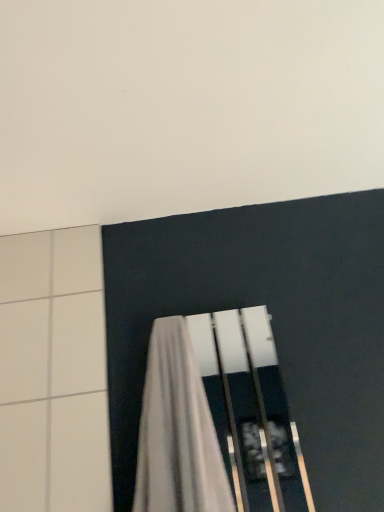
This screenshot has height=512, width=384. Describe the element at coordinates (184, 106) in the screenshot. I see `white matte wall at upper center` at that location.

The width and height of the screenshot is (384, 512). I want to click on white matte wall at upper center, so click(184, 106).

Find the location of `white fabric curtain at lower center`. white fabric curtain at lower center is located at coordinates (177, 431).

Describe the element at coordinates (177, 431) in the screenshot. The width and height of the screenshot is (384, 512). I see `white fabric curtain at lower center` at that location.

Where is `white matte wall at upper center`? This screenshot has height=512, width=384. white matte wall at upper center is located at coordinates (184, 106).

Considering the relative positions of white fabric curtain at lower center and white matte wall at upper center in the image provided, is white fabric curtain at lower center to the left or to the right of white matte wall at upper center?

white fabric curtain at lower center is positioned on white matte wall at upper center's left side.

Does white fabric curtain at lower center lie behind white matte wall at upper center?

Yes, it is behind white matte wall at upper center.

Between point (177, 404) and point (134, 104), which one is positioned in front?

The point (134, 104) is closer to the camera.

From the image's perspective, who appears lower, white fabric curtain at lower center or white matte wall at upper center?

white fabric curtain at lower center, from the image's perspective.

Consider the image. From a real-world perspective, is white fabric curtain at lower center positioned under white matte wall at upper center based on gravity?

Yes, from a real-world perspective, white fabric curtain at lower center is beneath white matte wall at upper center.

Which object is wider, white fabric curtain at lower center or white matte wall at upper center?

white matte wall at upper center is wider.

Which of these two, white fabric curtain at lower center or white matte wall at upper center, stands shorter?

white matte wall at upper center.

Can you confirm if white fabric curtain at lower center is bigger than white matte wall at upper center?

Correct, white fabric curtain at lower center is larger in size than white matte wall at upper center.

Which is correct: white fabric curtain at lower center is inside white matte wall at upper center, or outside of it?

white fabric curtain at lower center is outside white matte wall at upper center.

Is white fabric curtain at lower center positioned far away from white matte wall at upper center?

No, white fabric curtain at lower center is not far from white matte wall at upper center.

Does white fabric curtain at lower center turn towards white matte wall at upper center?

No, white fabric curtain at lower center is not oriented towards white matte wall at upper center.

Where is `backdrop located on the right of white fabric curtain at lower center`? backdrop located on the right of white fabric curtain at lower center is located at coordinates (184, 106).

Considering the positions of objects white matte wall at upper center and white fabric curtain at lower center in the image provided, who is more to the left, white matte wall at upper center or white fabric curtain at lower center?

white fabric curtain at lower center.

Which is behind, white matte wall at upper center or white fabric curtain at lower center?

white fabric curtain at lower center is behind.

Is point (133, 83) closer to viewer compared to point (175, 484)?

Yes.

From the image's perspective, is white matte wall at upper center above white fabric curtain at lower center?

Indeed, from the image's perspective, white matte wall at upper center is shown above white fabric curtain at lower center.

From a real-world perspective, is white matte wall at upper center located beneath white fabric curtain at lower center?

No, from a real-world perspective, white matte wall at upper center is not beneath white fabric curtain at lower center.

Is white matte wall at upper center wider or thinner than white fabric curtain at lower center?

white matte wall at upper center is wider than white fabric curtain at lower center.

Which of these two, white matte wall at upper center or white fabric curtain at lower center, stands shorter?

→ white matte wall at upper center.

Is white matte wall at upper center bigger than white fabric curtain at lower center?

No.

Would you say white matte wall at upper center contains white fabric curtain at lower center?

That's incorrect, white fabric curtain at lower center is not inside white matte wall at upper center.

Is white matte wall at upper center placed right next to white fabric curtain at lower center?

No, white matte wall at upper center is not with white fabric curtain at lower center.

Is white matte wall at upper center oriented towards white fabric curtain at lower center?

No, white matte wall at upper center is not oriented towards white fabric curtain at lower center.

Where is `curtain below the white matte wall at upper center (from a real-world perspective)`? This screenshot has width=384, height=512. curtain below the white matte wall at upper center (from a real-world perspective) is located at coordinates (177, 431).

This screenshot has width=384, height=512. In the image, there is a white matte wall at upper center. Identify the location of curtain below it (from the image's perspective). (177, 431).

Image resolution: width=384 pixels, height=512 pixels. In order to click on curtain on the left of white matte wall at upper center in this screenshot , I will do `click(177, 431)`.